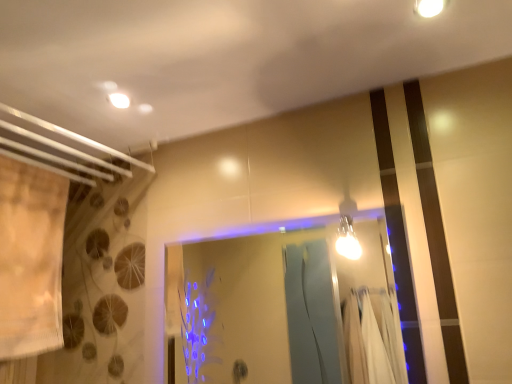
Question: Considering their positions, is transparent glass door at center located in front of or behind matte white light fixture at upper left?

Choices:
 (A) front
 (B) behind

Answer: (A)

Question: Is transparent glass door at center inside or outside of matte white light fixture at upper left?

Choices:
 (A) inside
 (B) outside

Answer: (B)

Question: Estimate the real-world distances between objects in this image. Which object is farther from the beige fabric shower curtain at left?

Choices:
 (A) transparent glass door at center
 (B) white glossy light fixture at upper right, the second light fixture from the left
 (C) matte white light fixture at upper left
 (D) bright metallic bulb at upper right, the 1th light fixture when ordered from bottom to top

Answer: (D)

Question: Considering the real-world distances, which object is closest to the white glossy light fixture at upper right, which is the first light fixture from front to back?

Choices:
 (A) transparent glass door at center
 (B) matte white light fixture at upper left
 (C) beige fabric shower curtain at left
 (D) bright metallic bulb at upper right, which is the second light fixture from top to bottom

Answer: (B)